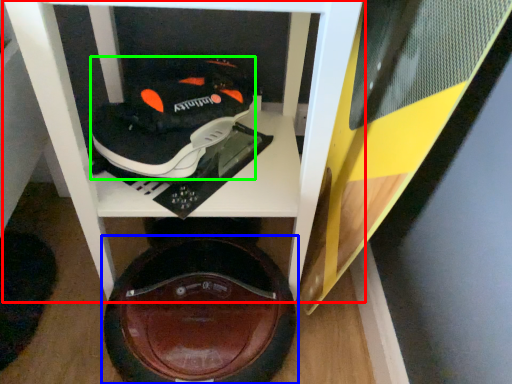
Question: Based on their relative distances, which object is farther from furniture (highlighted by a red box)? Choose from footwear (highlighted by a blue box) and shoe (highlighted by a green box).

Choices:
 (A) footwear
 (B) shoe

Answer: (A)